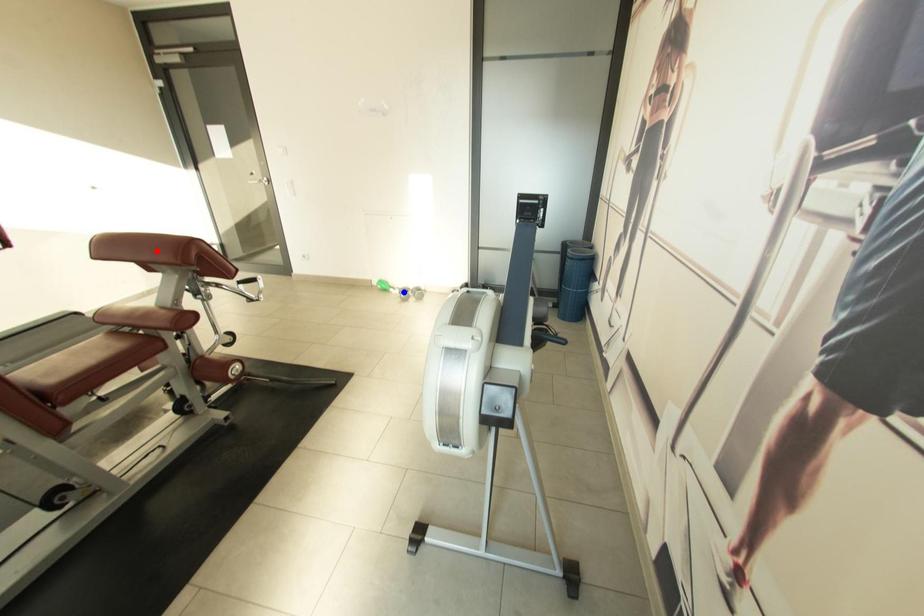
Question: Which of the two points in the image is closer to the camera?

Choices:
 (A) Blue point is closer.
 (B) Red point is closer.

Answer: (B)